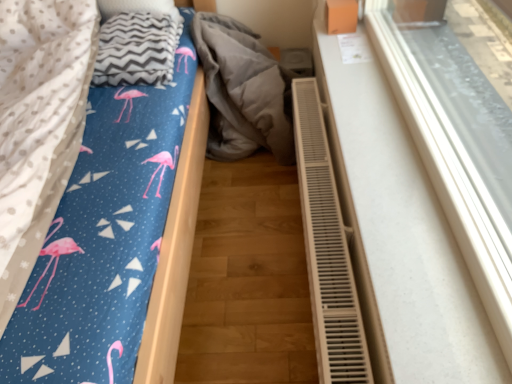
Describe the element at coordinates (38, 124) in the screenshot. This screenshot has width=512, height=384. I see `flamingo-patterned fabric at left` at that location.

Find the location of a particular element. gray zigzag blanket at upper left is located at coordinates pyautogui.click(x=137, y=42).

Measure the distance between white plastic radiator at right and camera.

The distance of white plastic radiator at right from camera is 27.26 inches.

Identify the location of gray fabric at center. (241, 91).

Based on their sizes in the image, would you say gray fabric at center is bigger or smaller than blue fabric bed at center?

gray fabric at center is smaller than blue fabric bed at center.

How distant is gray fabric at center from blue fabric bed at center?

gray fabric at center is 19.63 inches from blue fabric bed at center.

Is gray fabric at center located outside blue fabric bed at center?

That's correct, gray fabric at center is outside of blue fabric bed at center.

How different are the orientations of gray fabric at center and blue fabric bed at center in degrees?

The facing directions of gray fabric at center and blue fabric bed at center are 1.61 degrees apart.

Considering the sizes of objects white plastic radiator at right and flamingo-patterned fabric at left in the image provided, who is smaller, white plastic radiator at right or flamingo-patterned fabric at left?

With smaller size is white plastic radiator at right.

Considering the positions of objects white plastic radiator at right and flamingo-patterned fabric at left in the image provided, who is more to the left, white plastic radiator at right or flamingo-patterned fabric at left?

flamingo-patterned fabric at left is more to the left.

Is point (437, 151) positioned behind point (54, 179)?

No, it is in front of (54, 179).

How much distance is there between white plastic radiator at right and flamingo-patterned fabric at left?

white plastic radiator at right is 3.37 feet from flamingo-patterned fabric at left.

From a real-world perspective, who is located lower, flamingo-patterned fabric at left or white plastic radiator at right?

In real-world perspective, flamingo-patterned fabric at left is lower.

Who is shorter, flamingo-patterned fabric at left or white plastic radiator at right?

flamingo-patterned fabric at left is shorter.

Based on the photo, how many degrees apart are the facing directions of flamingo-patterned fabric at left and white plastic radiator at lower right?

The angle between the facing direction of flamingo-patterned fabric at left and the facing direction of white plastic radiator at lower right is 91.3 degrees.

Which is correct: flamingo-patterned fabric at left is inside white plastic radiator at lower right, or outside of it?

flamingo-patterned fabric at left is spatially situated outside white plastic radiator at lower right.

Is point (67, 105) more distant than point (344, 356)?

Yes.

From the image's perspective, does flamingo-patterned fabric at left appear lower than white plastic radiator at lower right?

No, from the image's perspective, flamingo-patterned fabric at left is not below white plastic radiator at lower right.

Is gray fabric at center spatially inside flamingo-patterned fabric at left, or outside of it?

gray fabric at center lies outside flamingo-patterned fabric at left.

Is gray fabric at center positioned behind flamingo-patterned fabric at left?

Yes, the depth of gray fabric at center is greater than that of flamingo-patterned fabric at left.

Which is less distant, (x=233, y=54) or (x=18, y=15)?

Clearly, point (x=233, y=54) is more distant from the camera than point (x=18, y=15).

At what (x,y) coordinates should I click in order to perform the action: click on blanket that appears above the blue fabric bed at center (from the image's perspective). Please return your answer as a coordinate pair (x, y). Looking at the image, I should click on (137, 42).

Considering the relative sizes of gray zigzag blanket at upper left and blue fabric bed at center in the image provided, is gray zigzag blanket at upper left wider than blue fabric bed at center?

In fact, gray zigzag blanket at upper left might be narrower than blue fabric bed at center.

Does gray zigzag blanket at upper left have a greater height compared to blue fabric bed at center?

No, gray zigzag blanket at upper left is not taller than blue fabric bed at center.

Can you confirm if gray zigzag blanket at upper left is bigger than blue fabric bed at center?

Incorrect, gray zigzag blanket at upper left is not larger than blue fabric bed at center.

Is gray fabric at center at the back of flamingo-patterned fabric at left?

No, flamingo-patterned fabric at left's orientation is not away from gray fabric at center.

You are a GUI agent. You are given a task and a screenshot of the screen. Output one action in this format:
    pyautogui.click(x=<x>, y=<y>)
    Task: Click on the material on the right of flamingo-patterned fabric at left
    This screenshot has height=384, width=512.
    Given the screenshot: What is the action you would take?
    pyautogui.click(x=241, y=91)

Is flamingo-patterned fabric at left located outside gray fabric at center?

Absolutely, flamingo-patterned fabric at left is external to gray fabric at center.

Which is closer, (37, 176) or (275, 60)?

Point (37, 176)

Identify the location of material behind the blue fabric bed at center. This screenshot has width=512, height=384. (241, 91).

Where is `mattress beneath the white plastic radiator at right (from a real-world perspective)`? This screenshot has height=384, width=512. mattress beneath the white plastic radiator at right (from a real-world perspective) is located at coordinates (38, 124).

Estimate the real-world distances between objects in this image. Which object is further from flamingo-patterned fabric at left, gray zigzag blanket at upper left or blue fabric bed at center?

gray zigzag blanket at upper left is further to flamingo-patterned fabric at left.

Considering their positions, is white plastic radiator at lower right positioned closer to blue fabric bed at center than gray fabric at center?

gray fabric at center is positioned closer to the anchor blue fabric bed at center.

Which object lies nearer to the anchor point gray zigzag blanket at upper left, gray fabric at center or white plastic radiator at lower right?

gray fabric at center.

Looking at the image, which one is located closer to white plastic radiator at right, gray zigzag blanket at upper left or gray fabric at center?

gray fabric at center is closer to white plastic radiator at right.

Estimate the real-world distances between objects in this image. Which object is closer to blue fabric bed at center, gray fabric at center or gray zigzag blanket at upper left?

Among the two, gray zigzag blanket at upper left is located nearer to blue fabric bed at center.

From the picture: When comparing their distances from gray zigzag blanket at upper left, does gray fabric at center or blue fabric bed at center seem closer?

blue fabric bed at center is closer to gray zigzag blanket at upper left.

Considering their positions, is blue fabric bed at center positioned further to gray fabric at center than flamingo-patterned fabric at left?

flamingo-patterned fabric at left.

Based on their spatial positions, is white plastic radiator at right or blue fabric bed at center closer to gray zigzag blanket at upper left?

Among the two, blue fabric bed at center is located nearer to gray zigzag blanket at upper left.

Find the location of a particular element. The image size is (512, 384). air conditioner located between white plastic radiator at right and gray fabric at center in the depth direction is located at coordinates (327, 248).

Identify the location of mattress positioned between white plastic radiator at right and gray fabric at center from near to far. (38, 124).

Identify the location of blanket between flamingo-patterned fabric at left and gray fabric at center along the z-axis. (137, 42).

Where is `bed between white plastic radiator at right and gray zigzag blanket at upper left in the front-back direction`? bed between white plastic radiator at right and gray zigzag blanket at upper left in the front-back direction is located at coordinates (92, 203).